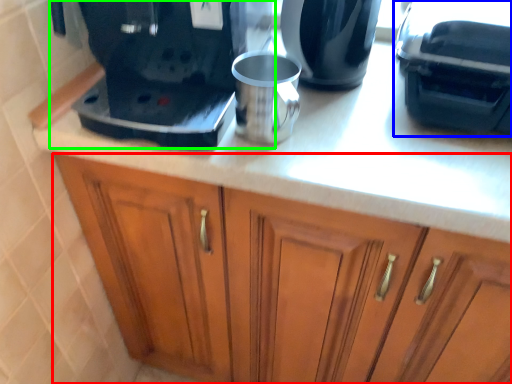
Question: Considering the real-world distances, which object is closest to cabinetry (highlighted by a red box)? coffee machine (highlighted by a blue box) or home appliance (highlighted by a green box).

Choices:
 (A) coffee machine
 (B) home appliance

Answer: (B)